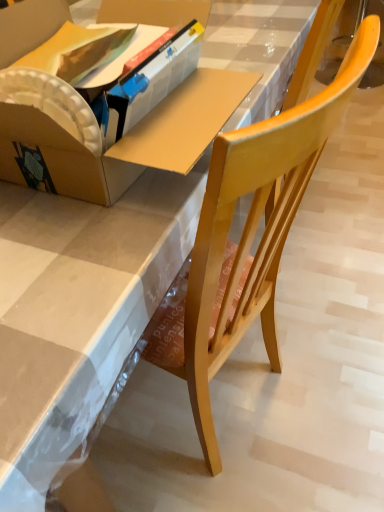
Question: Is point (198, 71) positioned closer to the camera than point (279, 361)?

Choices:
 (A) closer
 (B) farther

Answer: (A)

Question: From a real-world perspective, relative to wooden chair at center, is matte cardboard box at center vertically above or below?

Choices:
 (A) above
 (B) below

Answer: (A)

Question: Based on their sizes in the image, would you say matte cardboard box at center is bigger or smaller than wooden chair at center?

Choices:
 (A) small
 (B) big

Answer: (A)

Question: From a real-world perspective, is wooden chair at center physically located above or below matte cardboard box at center?

Choices:
 (A) above
 (B) below

Answer: (B)

Question: Considering their positions, is wooden chair at center located in front of or behind matte cardboard box at center?

Choices:
 (A) front
 (B) behind

Answer: (A)

Question: Considering the positions of point (367, 46) and point (195, 154), is point (367, 46) closer or farther from the camera than point (195, 154)?

Choices:
 (A) farther
 (B) closer

Answer: (B)

Question: From the image's perspective, is wooden chair at center above or below matte cardboard box at center?

Choices:
 (A) above
 (B) below

Answer: (B)